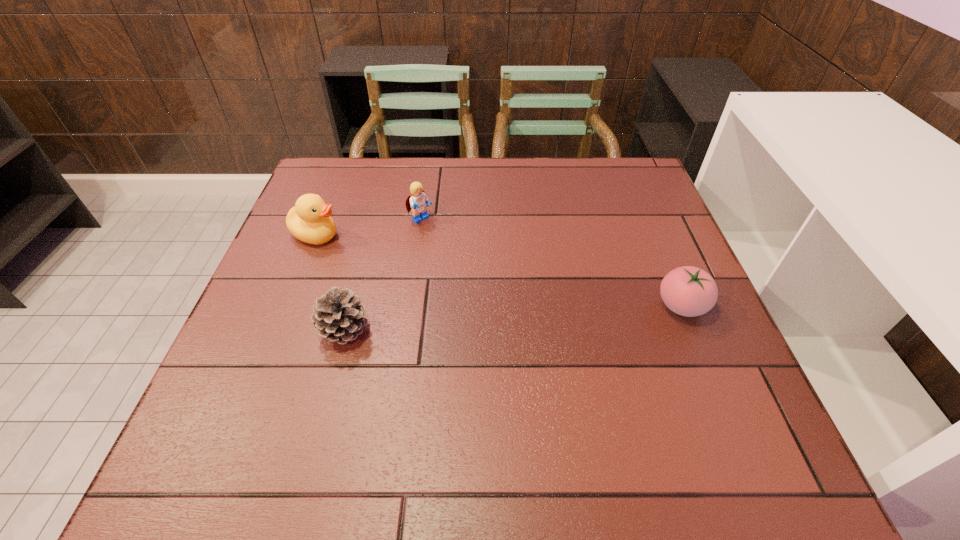
Where is `the third object from right to left`? The height and width of the screenshot is (540, 960). the third object from right to left is located at coordinates (338, 316).

This screenshot has width=960, height=540. Identify the location of the rightmost object. pos(689,291).

Where is `the leftmost object`? This screenshot has height=540, width=960. the leftmost object is located at coordinates (309, 220).

At what (x,y) coordinates should I click in order to perform the action: click on Lego. Please return your answer as a coordinate pair (x, y). Image resolution: width=960 pixels, height=540 pixels. Looking at the image, I should click on (417, 201).

I want to click on free space located on the back of the pinecone, so click(374, 218).

The width and height of the screenshot is (960, 540). In order to click on free region located 0.300m on the back of the tomato in this screenshot , I will do `click(640, 207)`.

Locate an element on the screen. free spot located at the beak of the duck is located at coordinates (436, 279).

Where is `free space located at the beak of the duck`? The image size is (960, 540). free space located at the beak of the duck is located at coordinates (390, 261).

Where is `free space located 0.310m at the beak of the duck`? This screenshot has height=540, width=960. free space located 0.310m at the beak of the duck is located at coordinates (444, 282).

This screenshot has width=960, height=540. I want to click on vacant space situated on the front-facing side of the Lego, so click(x=444, y=241).